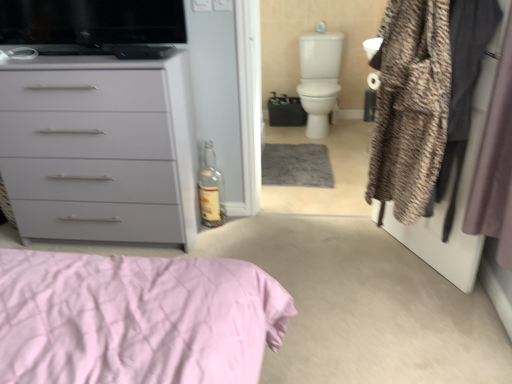
Image resolution: width=512 pixels, height=384 pixels. In order to click on unoccupied region to the right of transparent glass bottle at center in this screenshot , I will do `click(241, 224)`.